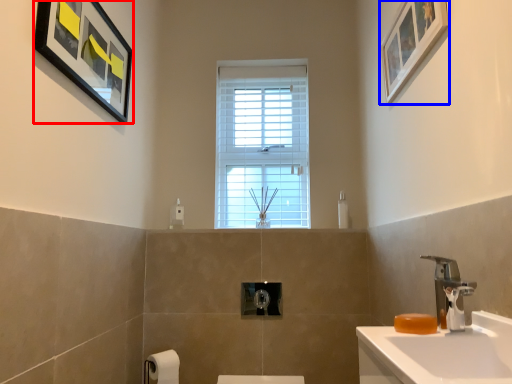
Question: Which object appears farthest to the camera in this image, picture frame (highlighted by a red box) or picture frame (highlighted by a blue box)?

Choices:
 (A) picture frame
 (B) picture frame

Answer: (A)